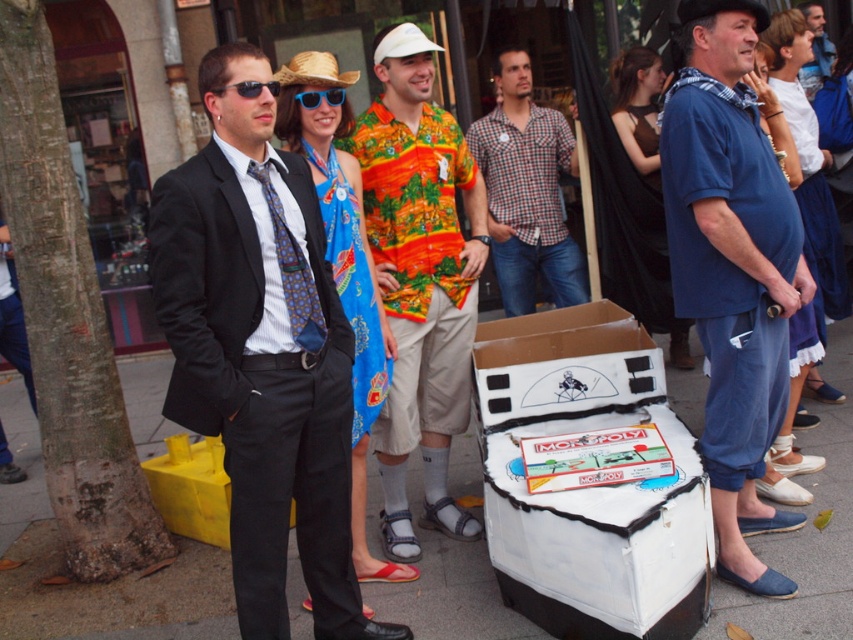
You are standing in the lively street scene and want to determine which of the two points, point (x=416, y=124) or point (x=809, y=29), is nearer to you. Based on the spatial relationship between them, which one is closer?

Point (x=416, y=124) is closer to the viewer than point (x=809, y=29).